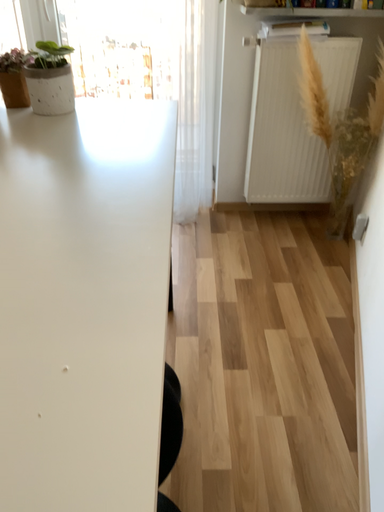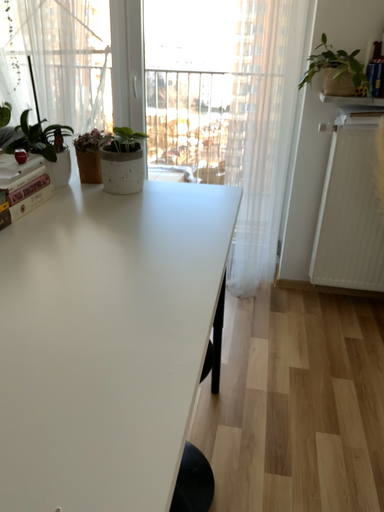
Question: How did the camera likely rotate when shooting the video?

Choices:
 (A) rotated left
 (B) rotated right

Answer: (A)